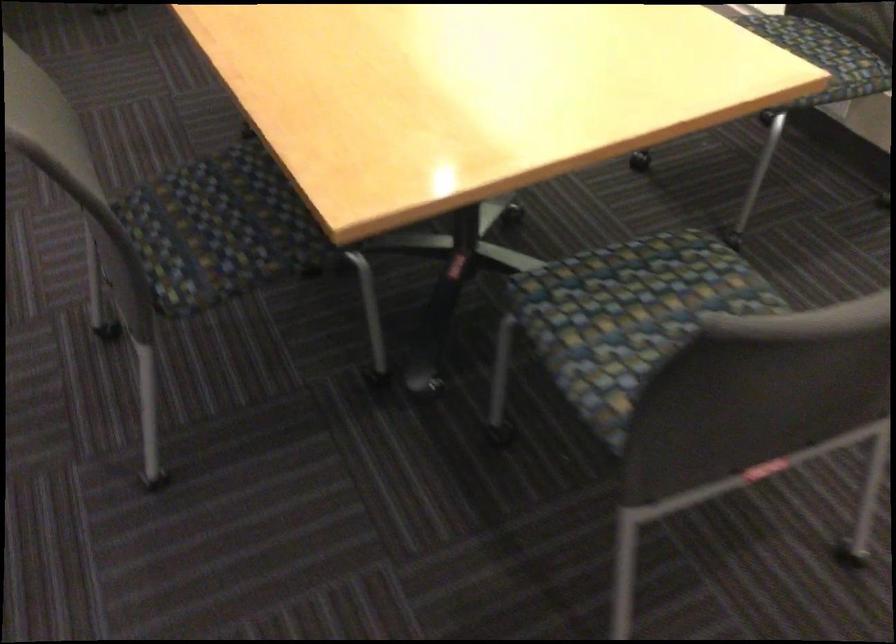
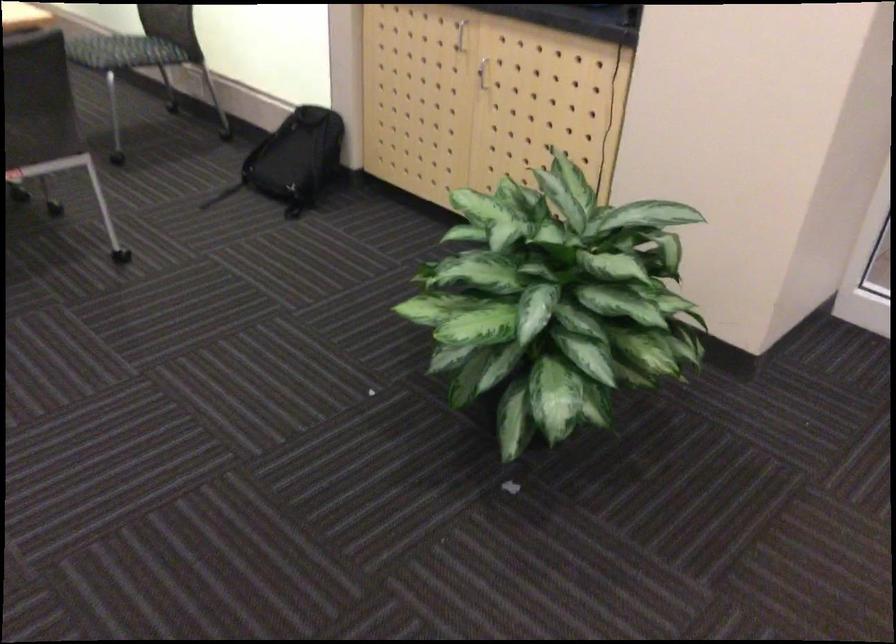
Which direction would the cameraman need to move to produce the second image?

The movement direction of the cameraman is right, backward.